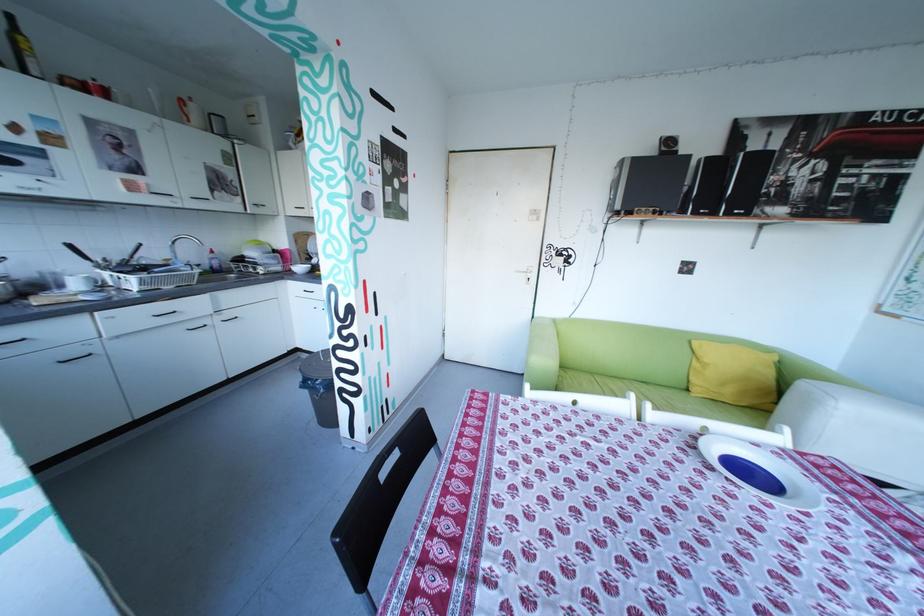
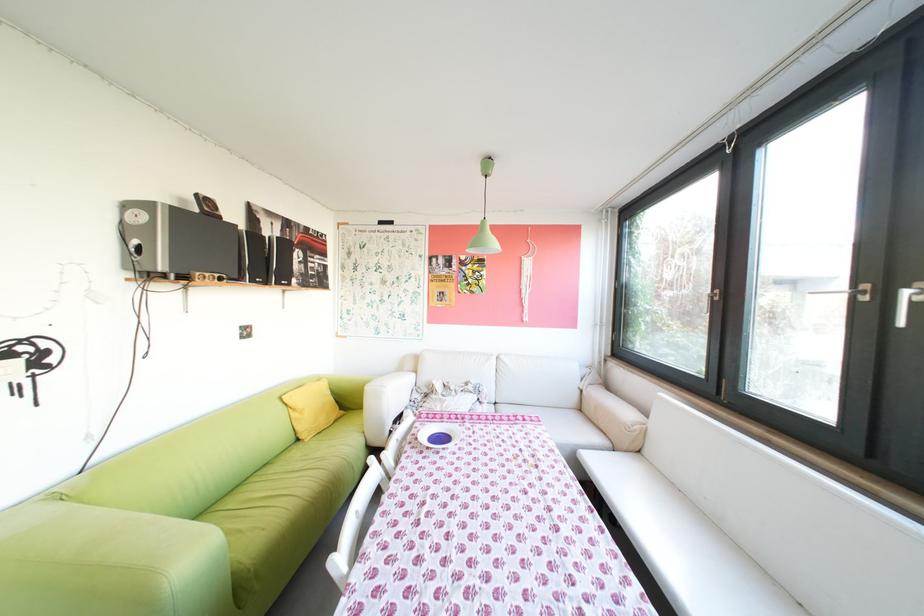
Locate, in the second image, the point that corresponds to (710,360) in the first image.

(307, 410)